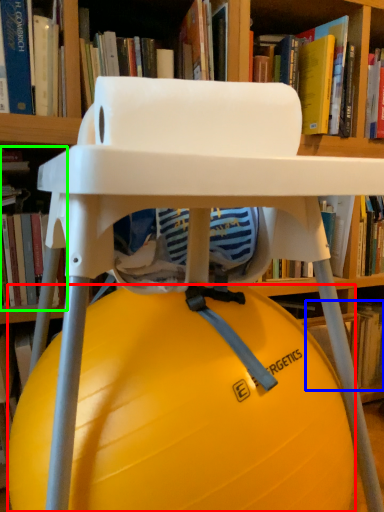
Question: Which object is the farthest from ball (highlighted by a red box)? Choose among these: book (highlighted by a blue box) or book (highlighted by a green box).

Choices:
 (A) book
 (B) book

Answer: (A)